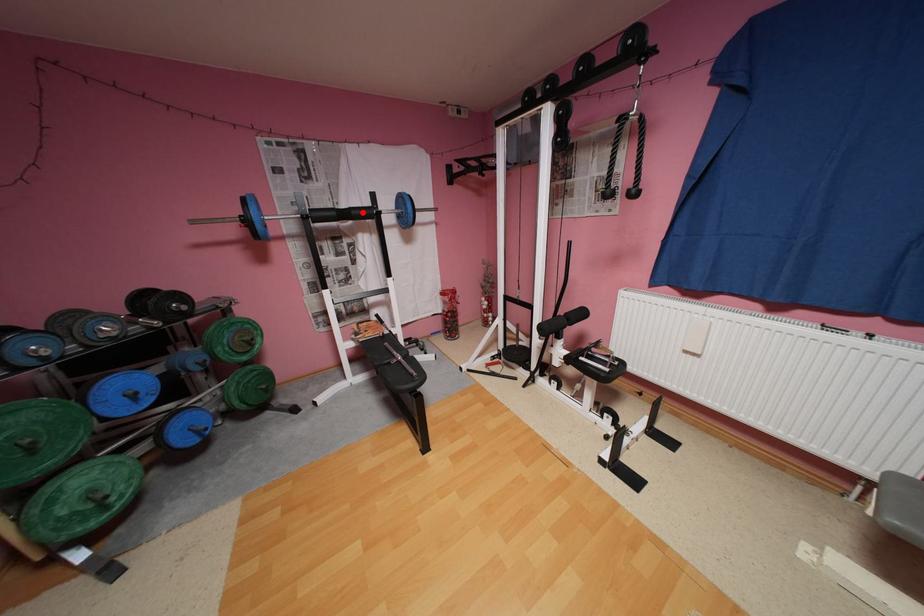
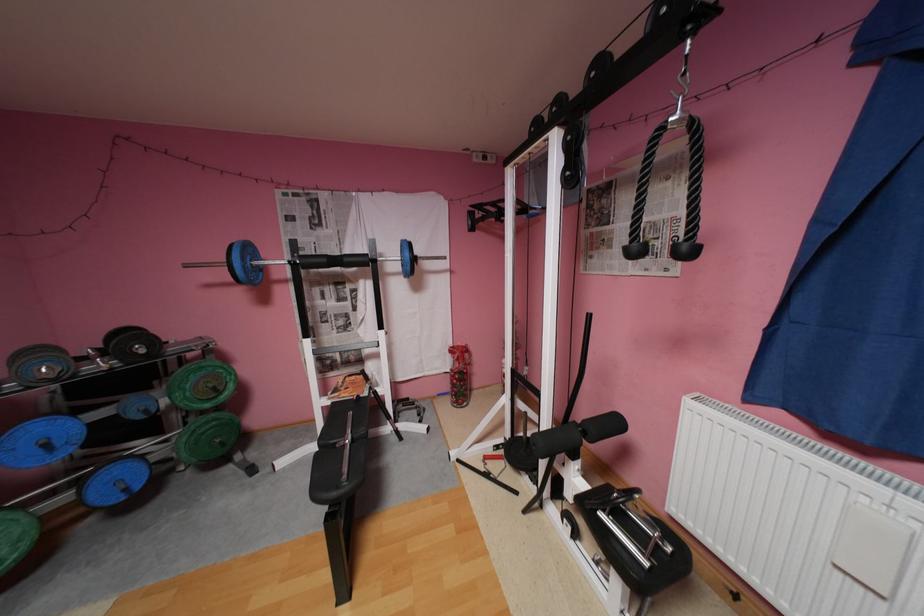
Find the pixel in the second image that matches the highlighted location in the first image.

(355, 259)